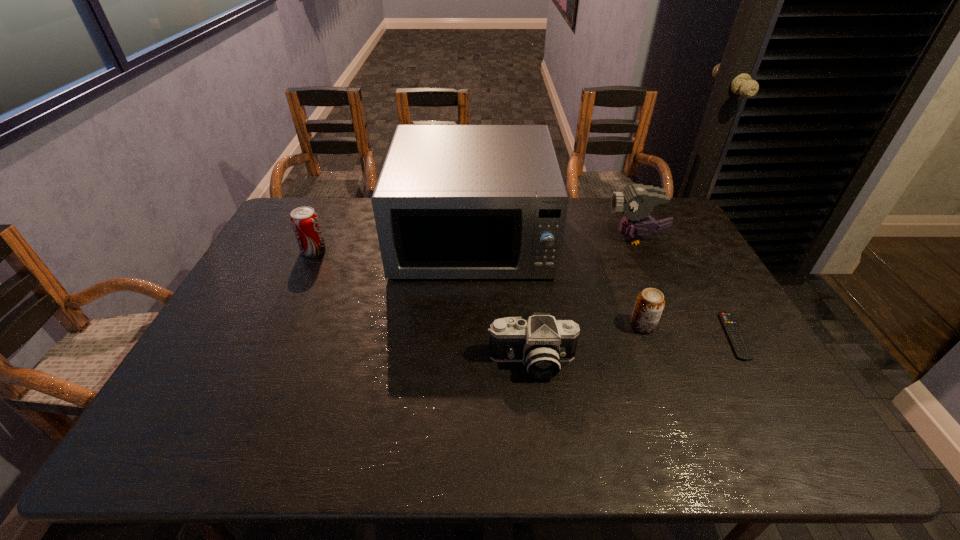
I want to click on object located in the far right corner section of the desktop, so click(x=637, y=201).

Locate an element on the screen. free space at the far edge of the desktop is located at coordinates (351, 213).

Where is `vacant space at the near edge`? vacant space at the near edge is located at coordinates (716, 424).

You are a GUI agent. You are given a task and a screenshot of the screen. Output one action in this format:
    pyautogui.click(x=<x>, y=<y>)
    Task: Click on the free space at the left edge of the desktop
    The height and width of the screenshot is (540, 960).
    Given the screenshot: What is the action you would take?
    pyautogui.click(x=278, y=259)

Where is `free space at the far left corner of the desktop`? The width and height of the screenshot is (960, 540). free space at the far left corner of the desktop is located at coordinates (324, 197).

Find the location of a particular element. The height and width of the screenshot is (540, 960). vacant area at the far right corner is located at coordinates (669, 229).

At what (x,y) coordinates should I click in order to perform the action: click on free space between the beer can and the fifth shortest object. Please return your answer as a coordinate pair (x, y). The width and height of the screenshot is (960, 540). Looking at the image, I should click on (639, 282).

Find the location of `unoccupied area between the bird and the beer can`. unoccupied area between the bird and the beer can is located at coordinates (639, 282).

Locate an element on the screen. The width and height of the screenshot is (960, 540). vacant area that lies between the microwave oven and the camera is located at coordinates (502, 300).

Where is `unoccupied position between the tallest object and the shortest object`? The height and width of the screenshot is (540, 960). unoccupied position between the tallest object and the shortest object is located at coordinates (603, 287).